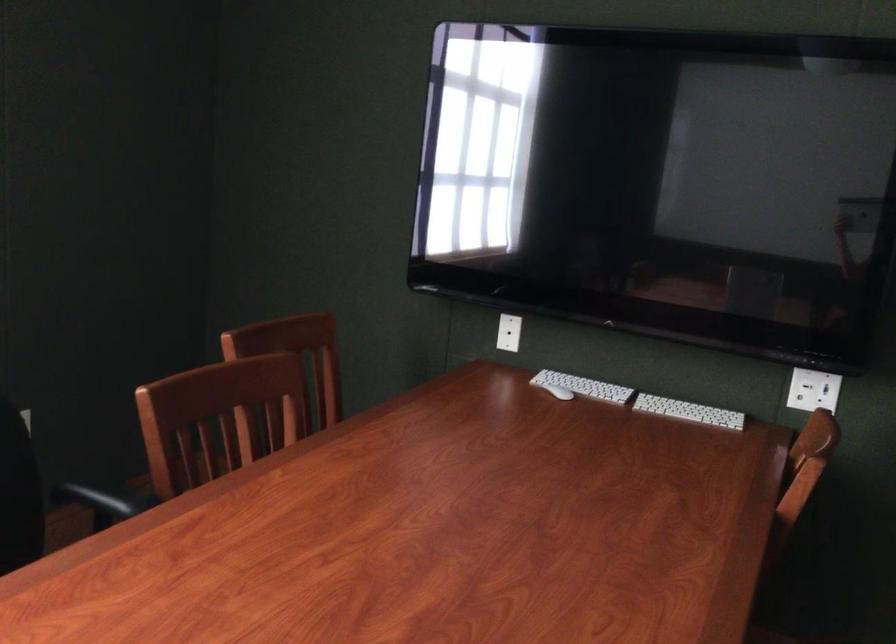
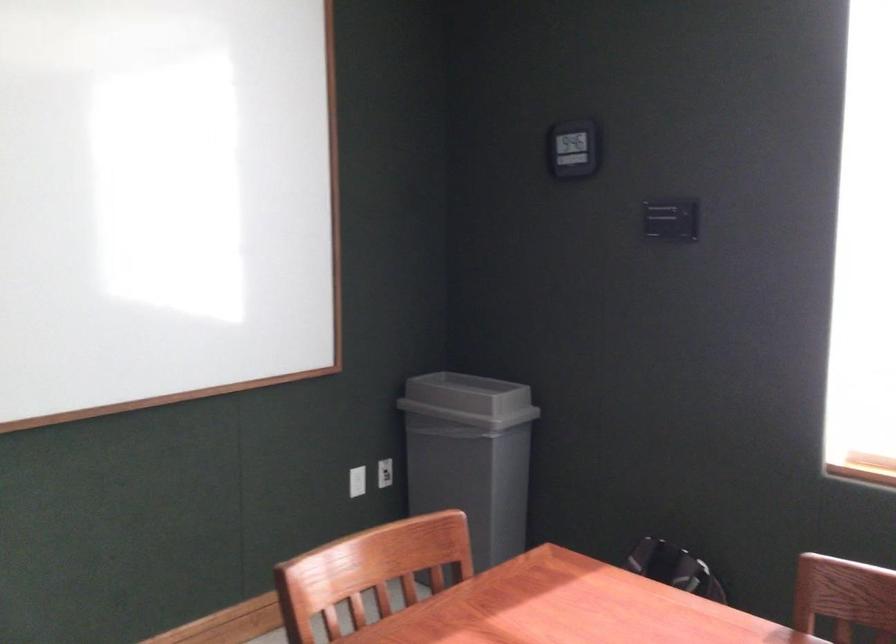
Question: The camera is either moving clockwise (left) or counter-clockwise (right) around the object. The first image is from the beginning of the video and the second image is from the end. Is the camera moving left or right when shooting the video?

Choices:
 (A) Left
 (B) Right

Answer: (B)